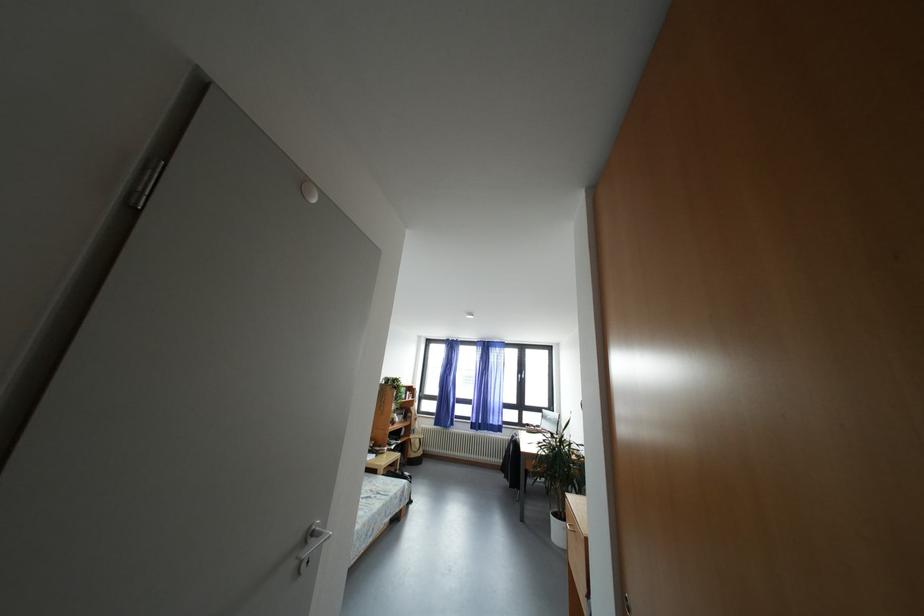
This screenshot has width=924, height=616. What do you see at coordinates (529, 456) in the screenshot?
I see `the chair sitting surface` at bounding box center [529, 456].